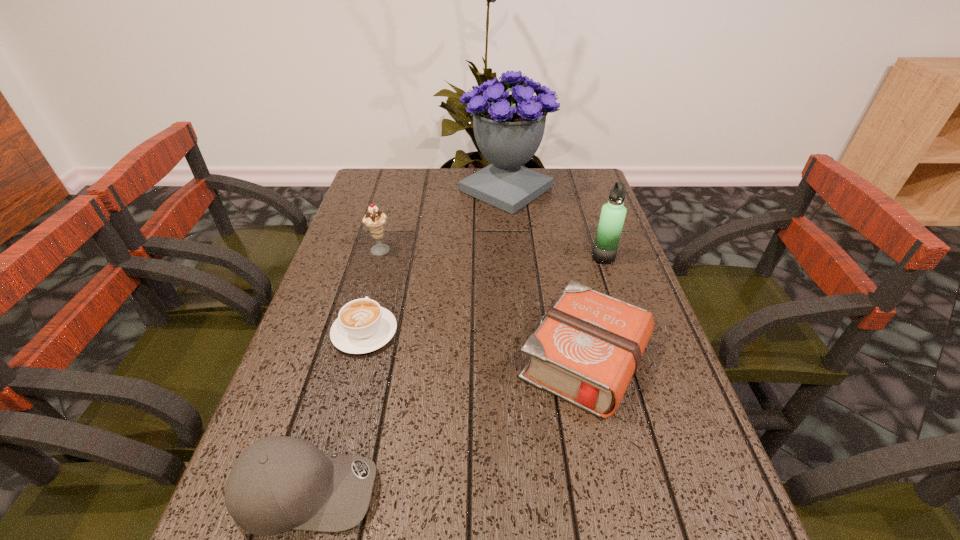
Where is `the tallest object`? the tallest object is located at coordinates (508, 128).

Where is `the farthest object`? This screenshot has width=960, height=540. the farthest object is located at coordinates (508, 128).

This screenshot has height=540, width=960. What are the coordinates of `the second tallest object` in the screenshot? It's located at (613, 213).

You are a GUI agent. You are given a task and a screenshot of the screen. Output one action in this format:
    pyautogui.click(x=<x>, y=<y>)
    Task: Click on the third tallest object
    The image size is (960, 540).
    Given the screenshot: What is the action you would take?
    pyautogui.click(x=374, y=220)

Identify the location of baseball cap. The height and width of the screenshot is (540, 960). (279, 483).

Locate an element on the screen. This screenshot has height=540, width=960. Bible is located at coordinates (587, 348).

This screenshot has width=960, height=540. What are the coordinates of `cappuccino` in the screenshot? It's located at (362, 326).

The image size is (960, 540). What are the coordinates of `free spot located on the front of the bouquet` in the screenshot? It's located at (515, 278).

The height and width of the screenshot is (540, 960). In order to click on vacant space located on the left of the thermos bottle in this screenshot , I will do 524,258.

The image size is (960, 540). What are the coordinates of `vacant area located on the back of the third tallest object` in the screenshot? It's located at (391, 212).